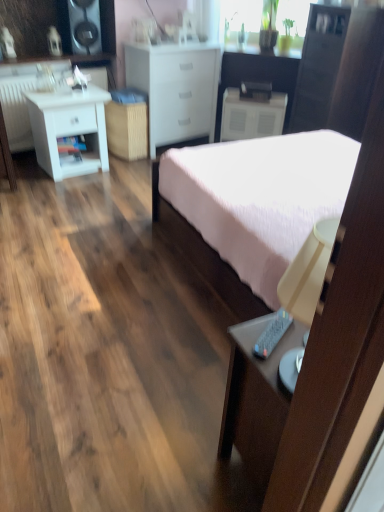
Image resolution: width=384 pixels, height=512 pixels. Describe the element at coordinates (251, 116) in the screenshot. I see `white matte nightstand at center, the second nightstand in the left-to-right sequence` at that location.

Measure the distance between matte black cabinet at upper right and camera.

The depth of matte black cabinet at upper right is 11.11 feet.

The height and width of the screenshot is (512, 384). Describe the element at coordinates (318, 66) in the screenshot. I see `matte black cabinet at upper right` at that location.

Based on the photo, measure the distance between point (173, 87) and camera.

They are 3.86 meters apart.

Locate an element on the screen. This screenshot has width=384, height=512. pink fabric bed at center is located at coordinates (252, 207).

Locate an element on the screen. black plastic remote control at lower right is located at coordinates (272, 334).

Identify the location of white matte nightstand at center, the 1th nightstand in the right-to-left sequence. The width and height of the screenshot is (384, 512). (251, 116).

Who is more distant, white matte nightstand at center, the second nightstand in the left-to-right sequence, or black glossy speaker at upper left?

white matte nightstand at center, the second nightstand in the left-to-right sequence, is further from the camera.

From the image's perspective, is white matte nightstand at center, which is counted as the 2th nightstand, starting from the front, positioned above or below black glossy speaker at upper left?

white matte nightstand at center, which is counted as the 2th nightstand, starting from the front, is below black glossy speaker at upper left.

Which of these two, white matte nightstand at center, acting as the 1th nightstand starting from the back, or black glossy speaker at upper left, stands shorter?

black glossy speaker at upper left.

Based on their sizes in the image, would you say black plastic remote control at lower right is bigger or smaller than white matte chest of drawers at center?

Considering their sizes, black plastic remote control at lower right takes up less space than white matte chest of drawers at center.

Which object is closer to the camera, black plastic remote control at lower right or white matte chest of drawers at center?

black plastic remote control at lower right.

In the scene shown: Which of these two, black plastic remote control at lower right or white matte chest of drawers at center, is thinner?

black plastic remote control at lower right is thinner.

Is black plastic remote control at lower right directly adjacent to white matte chest of drawers at center?

No, black plastic remote control at lower right is not in contact with white matte chest of drawers at center.

Between matte black cabinet at upper right and white matte chest of drawers at center, which one appears on the left side from the viewer's perspective?

white matte chest of drawers at center is more to the left.

From the image's perspective, is matte black cabinet at upper right beneath white matte chest of drawers at center?

No, from the image's perspective, matte black cabinet at upper right is not beneath white matte chest of drawers at center.

Does point (323, 126) come in front of point (212, 138)?

Yes.

From a real-world perspective, relative to white matte chest of drawers at center, is matte black cabinet at upper right vertically above or below?

Clearly, from a real-world perspective, matte black cabinet at upper right is above white matte chest of drawers at center.

Based on the photo, is white matte nightstand at left, arranged as the 2th nightstand when viewed from the right, placed right next to white matte chest of drawers at center?

No, white matte nightstand at left, arranged as the 2th nightstand when viewed from the right, is not beside white matte chest of drawers at center.

Considering their positions, is white matte nightstand at left, the first nightstand from the left, located in front of or behind white matte chest of drawers at center?

Visually, white matte nightstand at left, the first nightstand from the left, is located in front of white matte chest of drawers at center.

Which of these two, white matte nightstand at left, arranged as the 2th nightstand when viewed from the right, or white matte chest of drawers at center, stands taller?

With more height is white matte chest of drawers at center.

Between pink fabric bed at center and black glossy speaker at upper left, which one has smaller size?

black glossy speaker at upper left.

From the image's perspective, relative to black glossy speaker at upper left, is pink fabric bed at center above or below?

pink fabric bed at center is situated lower than black glossy speaker at upper left in the image.

Is pink fabric bed at center oriented away from black glossy speaker at upper left?

That's not correct — pink fabric bed at center is not looking away from black glossy speaker at upper left.

From a real-world perspective, which is physically below, pink fabric bed at center or black glossy speaker at upper left?

pink fabric bed at center, from a real-world perspective.

Could you tell me if white matte nightstand at left, acting as the first nightstand starting from the front, is facing pink fabric bed at center?

Yes, white matte nightstand at left, acting as the first nightstand starting from the front, is aimed at pink fabric bed at center.

Consider the image. Is white matte nightstand at left, the first nightstand from the left, to the left or to the right of pink fabric bed at center in the image?

white matte nightstand at left, the first nightstand from the left, is positioned on pink fabric bed at center's left side.

In the scene shown: From a real-world perspective, which object rests below the other?

white matte nightstand at left, arranged as the 2th nightstand when viewed from the right, is physically lower.

From the image's perspective, is white matte nightstand at left, acting as the first nightstand starting from the front, on top of pink fabric bed at center?

Yes, from the image's perspective, white matte nightstand at left, acting as the first nightstand starting from the front, is on top of pink fabric bed at center.

How much distance is there between black plastic remote control at lower right and white matte nightstand at left, acting as the first nightstand starting from the front?

They are 2.76 meters apart.

In the scene shown: Which object is more forward, black plastic remote control at lower right or white matte nightstand at left, arranged as the 2th nightstand when viewed from the back?

black plastic remote control at lower right is more forward.

Locate an element on the screen. The height and width of the screenshot is (512, 384). nightstand located on the left of black plastic remote control at lower right is located at coordinates (69, 129).

Is black plastic remote control at lower right looking in the opposite direction of white matte nightstand at left, acting as the first nightstand starting from the front?

No.

At what (x,y) coordinates should I click in order to perform the action: click on nightstand behind the black glossy speaker at upper left. Please return your answer as a coordinate pair (x, y). Looking at the image, I should click on (251, 116).

What are the coordinates of `equipment above the white matte chest of drawers at center (from a real-world perspective)` in the screenshot? It's located at (272, 334).

From the image, which object appears to be nearer to white matte nightstand at center, the 1th nightstand in the right-to-left sequence, pink fabric bed at center or white matte chest of drawers at center?

white matte chest of drawers at center is positioned closer to the anchor white matte nightstand at center, the 1th nightstand in the right-to-left sequence.

Based on their spatial positions, is matte black cabinet at upper right or white matte nightstand at center, which is counted as the 2th nightstand, starting from the front, further from white matte nightstand at left, arranged as the 2th nightstand when viewed from the back?

matte black cabinet at upper right.

Which object lies nearer to the anchor point pink fabric bed at center, black glossy speaker at upper left or white matte chest of drawers at center?

white matte chest of drawers at center lies closer to pink fabric bed at center than the other object.

When comparing their distances from white matte nightstand at left, the first nightstand from the left, does white matte nightstand at center, the 1th nightstand in the right-to-left sequence, or white matte chest of drawers at center seem closer?

white matte chest of drawers at center lies closer to white matte nightstand at left, the first nightstand from the left, than the other object.

Estimate the real-world distances between objects in this image. Which object is closer to white matte nightstand at left, arranged as the 2th nightstand when viewed from the right, white matte nightstand at center, the second nightstand in the left-to-right sequence, or matte black cabinet at upper right?

white matte nightstand at center, the second nightstand in the left-to-right sequence, is positioned closer to the anchor white matte nightstand at left, arranged as the 2th nightstand when viewed from the right.

Estimate the real-world distances between objects in this image. Which object is closer to black glossy speaker at upper left, matte black cabinet at upper right or black plastic remote control at lower right?

matte black cabinet at upper right is positioned closer to the anchor black glossy speaker at upper left.

Looking at this image, considering their positions, is black plastic remote control at lower right positioned further to white matte chest of drawers at center than pink fabric bed at center?

The object further to white matte chest of drawers at center is black plastic remote control at lower right.

Estimate the real-world distances between objects in this image. Which object is closer to black glossy speaker at upper left, pink fabric bed at center or white matte nightstand at center, the 1th nightstand in the right-to-left sequence?

The object closer to black glossy speaker at upper left is white matte nightstand at center, the 1th nightstand in the right-to-left sequence.

Locate an element on the screen. This screenshot has width=384, height=512. speaker between black plastic remote control at lower right and white matte nightstand at center, the 1th nightstand in the right-to-left sequence, from front to back is located at coordinates (85, 26).

In order to click on nightstand located between black plastic remote control at lower right and white matte chest of drawers at center in the depth direction in this screenshot , I will do `click(69, 129)`.

Identify the location of bed between black plastic remote control at lower right and black glossy speaker at upper left in the front-back direction. Image resolution: width=384 pixels, height=512 pixels. (252, 207).

The image size is (384, 512). Find the location of `nightstand positioned between pink fabric bed at center and white matte chest of drawers at center from near to far`. nightstand positioned between pink fabric bed at center and white matte chest of drawers at center from near to far is located at coordinates (69, 129).